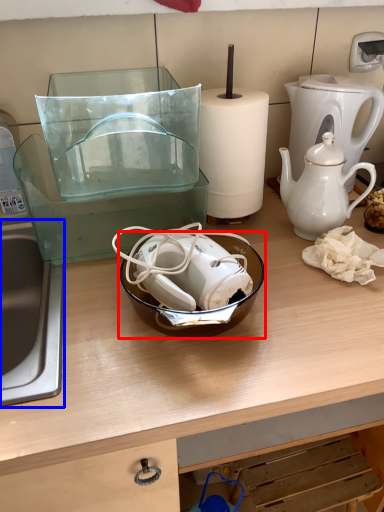
Question: Which object appears farthest to the camera in this image, bowl (highlighted by a red box) or sink (highlighted by a blue box)?

Choices:
 (A) bowl
 (B) sink

Answer: (A)